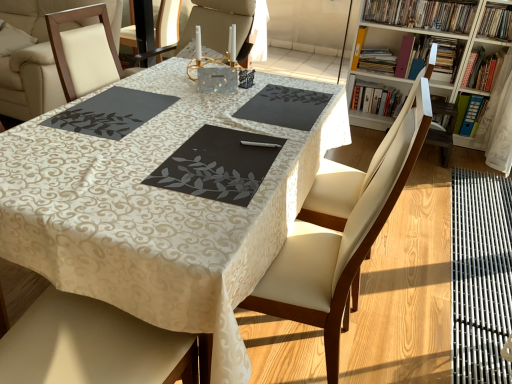
You are a GUI agent. You are given a task and a screenshot of the screen. Output one action in this format:
    pyautogui.click(x=<x>, y=<y>)
    Task: Click on the vacant area on top of black matte placemat at center, the 1th place mat when ordered from right to left (from a real-world perspective)
    The height and width of the screenshot is (384, 512).
    Given the screenshot: What is the action you would take?
    pyautogui.click(x=290, y=101)